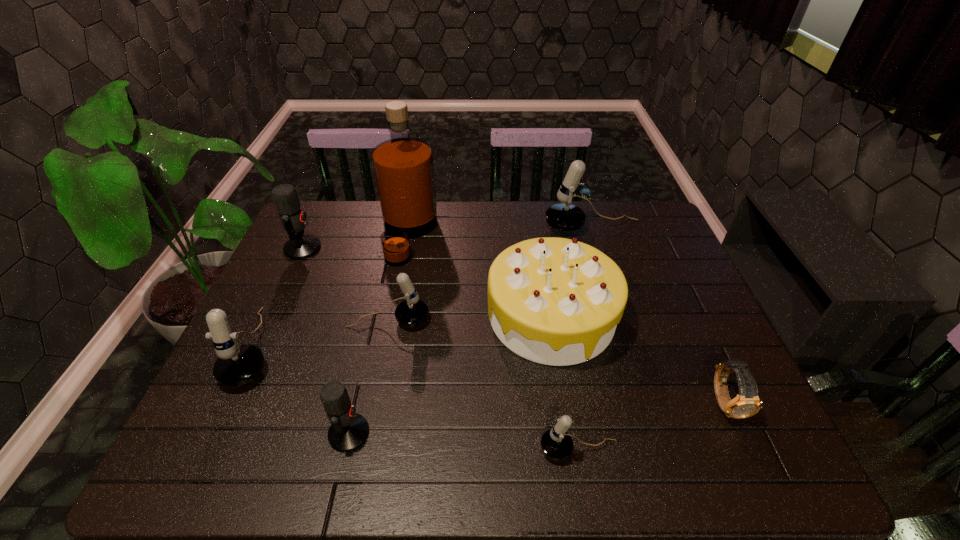
I want to click on free region located 0.050m on the face of the watch, so click(746, 448).

Identify the location of liquor located at the far edge. (403, 166).

Where is `microphone that is at the right edge`? microphone that is at the right edge is located at coordinates click(565, 217).

You are a GUI agent. You are given a task and a screenshot of the screen. Output one action in this format:
    pyautogui.click(x=<x>, y=<y>)
    Task: Click on the watch that is at the right edge
    This screenshot has height=540, width=960.
    Given the screenshot: What is the action you would take?
    pyautogui.click(x=747, y=403)

Image resolution: width=960 pixels, height=540 pixels. In order to click on object positioned at the far left corner in this screenshot , I will do click(x=300, y=246).

Image resolution: width=960 pixels, height=540 pixels. I want to click on object at the far right corner, so click(565, 217).

The width and height of the screenshot is (960, 540). Identify the location of blank area at the far edge. (511, 219).

This screenshot has width=960, height=540. Identify the location of vacant space at the near edge of the desktop. (481, 472).

You are a GUI agent. You are given a task and a screenshot of the screen. Output one action in this format:
    pyautogui.click(x=<x>, y=<y>)
    Task: Click on the vacant space at the left edge of the desktop
    
    Given the screenshot: What is the action you would take?
    (x=298, y=261)

Where is `vacant space at the right edge of the desktop`? vacant space at the right edge of the desktop is located at coordinates (681, 307).